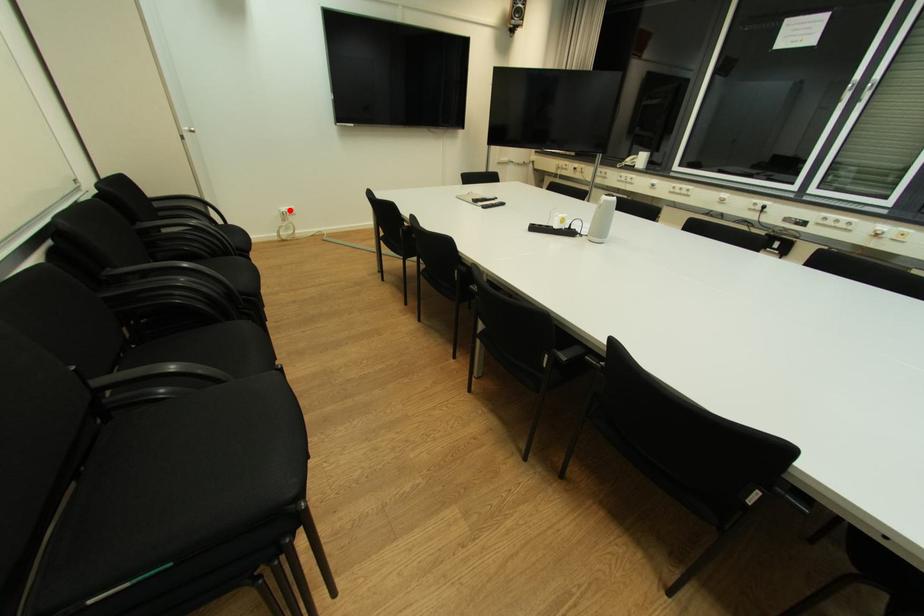
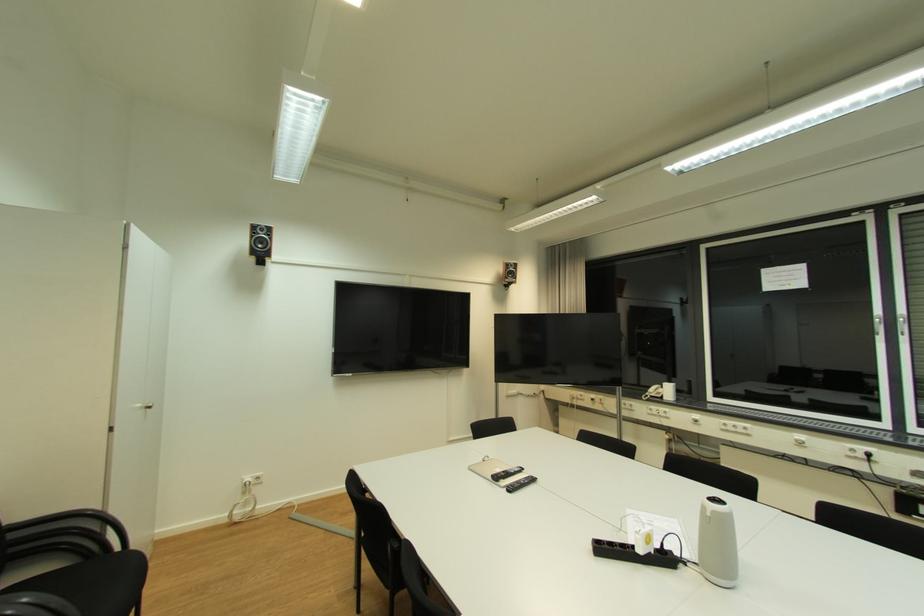
Question: I am providing you with two images of the same scene from different viewpoints. In image1, a red point is highlighted. Considering the same 3D point in image2, which of the following is correct?

Choices:
 (A) It is closer
 (B) It is farther

Answer: (B)